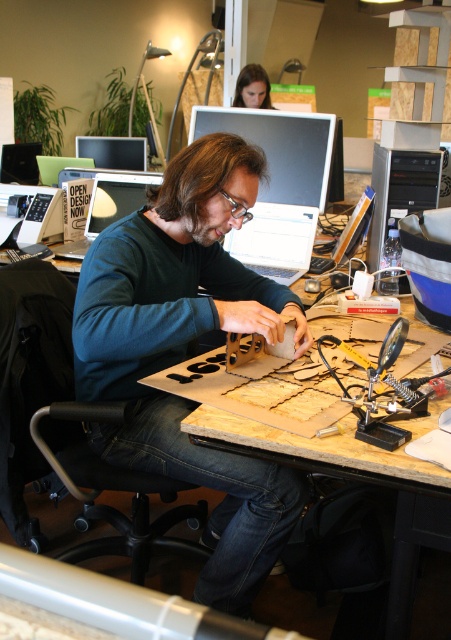
Is matte black laptop at upper center bigger than matte black hair at upper center?

Yes, matte black laptop at upper center is bigger than matte black hair at upper center.

Who is more forward, (271, 115) or (238, 99)?

Point (271, 115) is more forward.

Describe the element at coordinates (277, 179) in the screenshot. The image size is (451, 640). I see `matte black laptop at upper center` at that location.

Locate an element on the screen. matte black laptop at upper center is located at coordinates (277, 179).

In the scene shown: Does black plastic tower at right appear under matte black laptop at upper left?

Yes, black plastic tower at right is below matte black laptop at upper left.

Is point (372, 228) farther from camera compared to point (59, 252)?

No, (372, 228) is in front of (59, 252).

Does point (372, 163) come behind point (115, 205)?

No, it is not.

Identify the location of black plastic tower at right. The height and width of the screenshot is (640, 451). (400, 192).

Can you confirm if blue matte shirt at center is bigger than soldering iron at center?

Yes, blue matte shirt at center is bigger than soldering iron at center.

Between point (179, 337) and point (381, 403), which one is positioned behind?

Point (179, 337)

Find the location of a particular element. This screenshot has width=451, height=640. blue matte shirt at center is located at coordinates (188, 352).